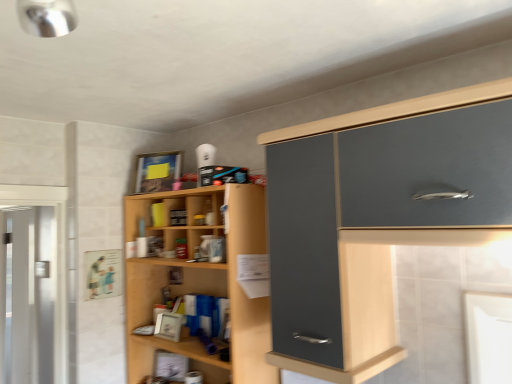
Question: Can you confirm if matte gray cabinet at upper right is taller than wooden shelves at center?

Choices:
 (A) no
 (B) yes

Answer: (A)

Question: Is matte gray cabinet at upper right beside wooden shelves at center?

Choices:
 (A) no
 (B) yes

Answer: (A)

Question: From the image's perspective, is matte gray cabinet at upper right on top of wooden shelves at center?

Choices:
 (A) yes
 (B) no

Answer: (A)

Question: From a real-world perspective, is matte gray cabinet at upper right positioned over wooden shelves at center based on gravity?

Choices:
 (A) yes
 (B) no

Answer: (A)

Question: From a real-world perspective, is matte gray cabinet at upper right below wooden shelves at center?

Choices:
 (A) yes
 (B) no

Answer: (B)

Question: Does matte gray cabinet at upper right turn towards wooden shelves at center?

Choices:
 (A) no
 (B) yes

Answer: (A)

Question: Considering the relative positions of clear glass screen door at left and wooden shelves at center in the image provided, is clear glass screen door at left in front of wooden shelves at center?

Choices:
 (A) no
 (B) yes

Answer: (A)

Question: Considering the relative sizes of clear glass screen door at left and wooden shelves at center in the image provided, is clear glass screen door at left shorter than wooden shelves at center?

Choices:
 (A) yes
 (B) no

Answer: (B)

Question: From a real-world perspective, is clear glass screen door at left on top of wooden shelves at center?

Choices:
 (A) no
 (B) yes

Answer: (A)

Question: Considering the relative sizes of clear glass screen door at left and wooden shelves at center in the image provided, is clear glass screen door at left wider than wooden shelves at center?

Choices:
 (A) no
 (B) yes

Answer: (A)

Question: Can you confirm if clear glass screen door at left is bigger than wooden shelves at center?

Choices:
 (A) no
 (B) yes

Answer: (A)

Question: Can we say clear glass screen door at left lies outside wooden shelves at center?

Choices:
 (A) no
 (B) yes

Answer: (B)

Question: Is matte gray cabinet at upper right oriented away from clear glass screen door at left?

Choices:
 (A) no
 (B) yes

Answer: (A)